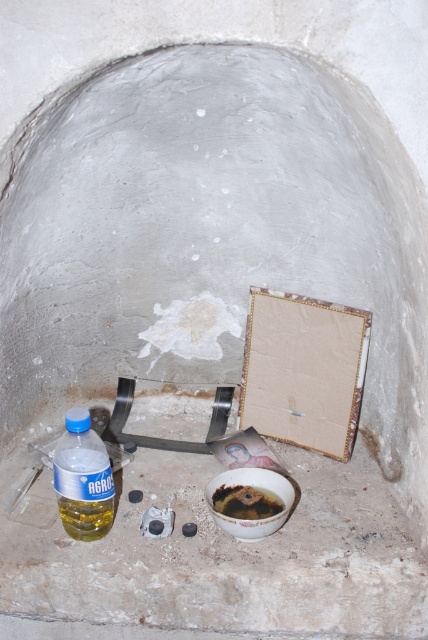
Does translucent yellow plastic bottle at lower left have a greater height compared to brown matte bowl at center?

Correct, translucent yellow plastic bottle at lower left is much taller as brown matte bowl at center.

Is translucent yellow plastic bottle at lower left in front of brown matte bowl at center?

That is True.

Does point (85, 512) come behind point (240, 488)?

That is False.

You are a GUI agent. You are given a task and a screenshot of the screen. Output one action in this format:
    pyautogui.click(x=<x>, y=<y>)
    Task: Click on the translucent yellow plastic bottle at lower left
    The width and height of the screenshot is (428, 640).
    Given the screenshot: What is the action you would take?
    pyautogui.click(x=83, y=477)

Is translucent yellow plastic bottle at lower left further to camera compared to yellow translucent oil at lower left?

No, translucent yellow plastic bottle at lower left is closer to the viewer.

Is point (85, 472) positioned behind point (100, 529)?

That is False.

Which is in front, point (103, 449) or point (64, 518)?

Positioned in front is point (64, 518).

What are the coordinates of `translucent yellow plastic bottle at lower left` in the screenshot? It's located at (83, 477).

Which of these two, yellow translucent oil at lower left or brown matte bowl at center, stands shorter?

Standing shorter between the two is brown matte bowl at center.

Image resolution: width=428 pixels, height=640 pixels. What do you see at coordinates (86, 516) in the screenshot?
I see `yellow translucent oil at lower left` at bounding box center [86, 516].

This screenshot has height=640, width=428. I want to click on yellow translucent oil at lower left, so click(86, 516).